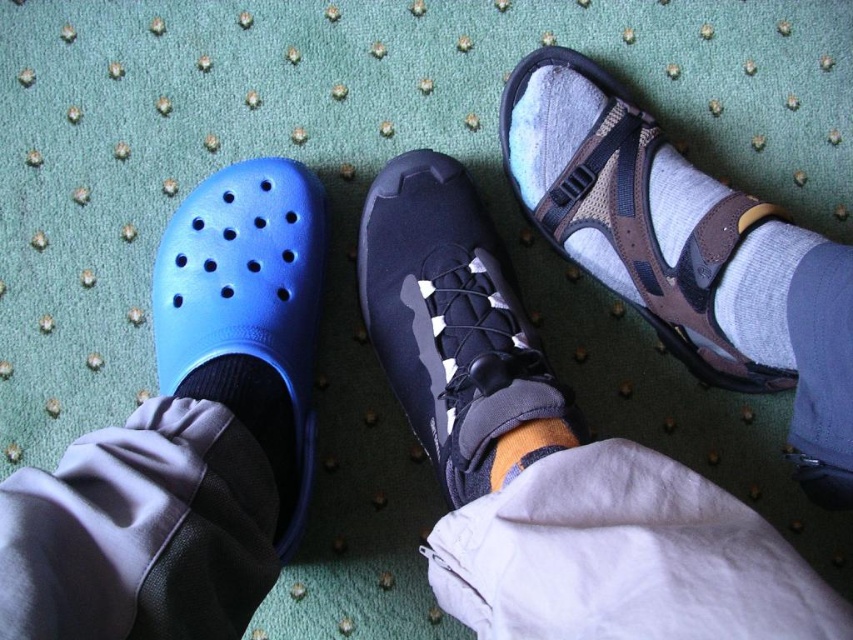
You are standing in a room with the two items mentioned. If you want to pick up the black knit sock at lower left first, which direction should you move relative to the navy suede sneaker at center?

You should move to the left relative to the navy suede sneaker at center to pick up the black knit sock at lower left since the navy suede sneaker at center is to the right of the black knit sock at lower left.